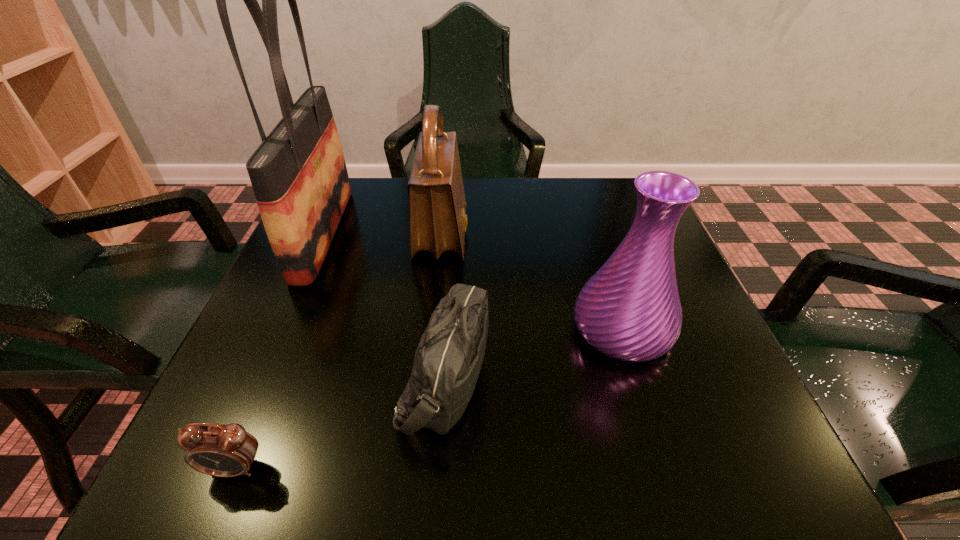
The image size is (960, 540). What are the coordinates of `the tallest object` in the screenshot? It's located at (299, 177).

Identify the location of vase. (630, 310).

Where is `the farther shoulder bag`? This screenshot has width=960, height=540. the farther shoulder bag is located at coordinates (438, 220).

The height and width of the screenshot is (540, 960). What are the coordinates of `the shorter shoulder bag` in the screenshot? It's located at (447, 363).

Image resolution: width=960 pixels, height=540 pixels. In order to click on the nearer shoulder bag in this screenshot , I will do `click(447, 363)`.

Find the location of a particular element. the shortest object is located at coordinates (217, 450).

Identify the location of alarm clock. The width and height of the screenshot is (960, 540). (217, 450).

I want to click on free space located on the front-facing side of the tallest object, so click(x=503, y=233).

The image size is (960, 540). What are the coordinates of `blank space located on the front of the vase` in the screenshot? It's located at (645, 403).

The height and width of the screenshot is (540, 960). What are the coordinates of `free space located on the front flap of the farther shoulder bag` in the screenshot? It's located at point(578,234).